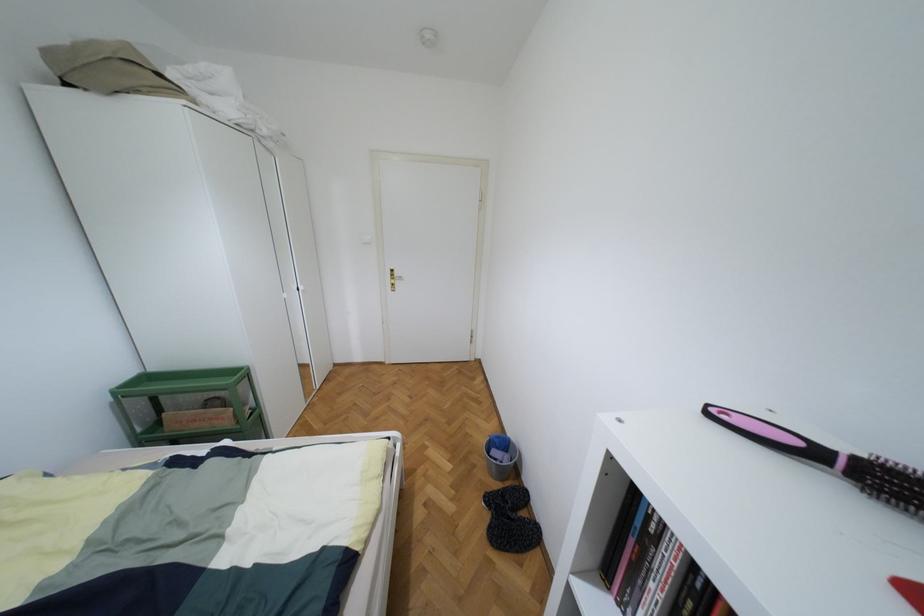
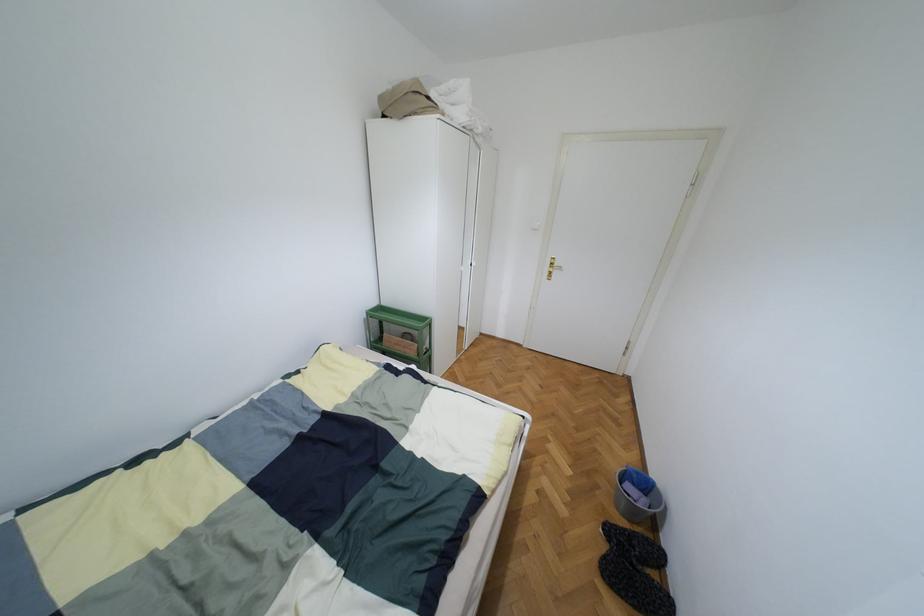
The point at (483, 496) is marked in the first image. Where is the corresponding point in the second image?

(603, 524)